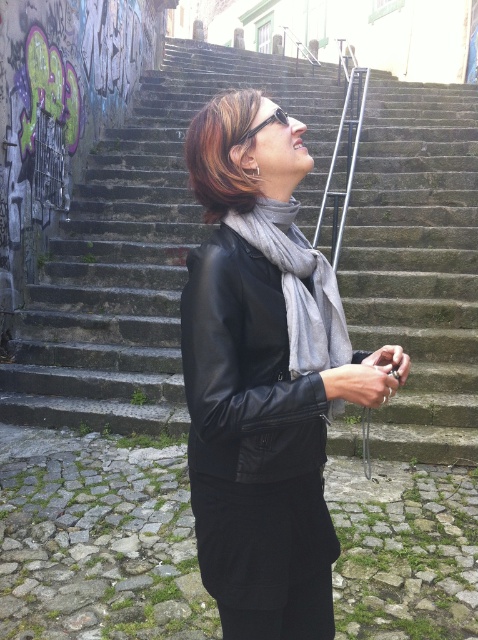
You are a photographer wanting to climb the concrete steps at center to get a better angle for your shot. The steps are 4.07 meters apart. If your average step length is 0.75 meters, how many steps will you need to take to reach the top?

The concrete steps at center are 4.07 meters apart. With an average step length of 0.75 meters, you would need approximately 5.43 steps. Since you can only take whole steps, you would need to take 6 steps to reach the top.

From the picture: The person is holding a camera and wants to take a photo of the graffiti on the wall to the left of the concrete steps at center. Considering the gray wool scarf at center is part of their outfit, will the scarf be visible in the photo if they aim the camera towards the graffiti?

The concrete steps at center is above gray wool scarf at center. Since the steps are positioned higher than the scarf, when the person aims the camera towards the graffiti to the left of the steps, the scarf, being lower, would likely not be in the frame unless the camera angle is adjusted downward. Therefore, the scarf might not be visible in the photo.